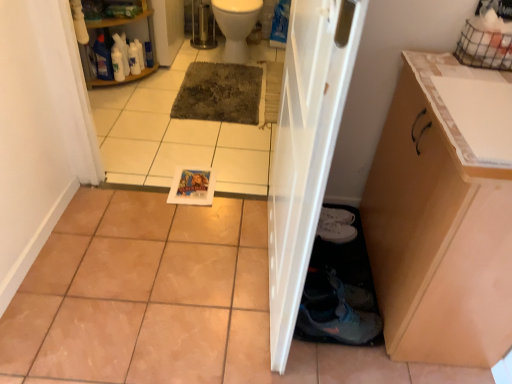
Locate an element on the screen. The image size is (512, 384). free space in front of white plastic shelf at upper left is located at coordinates (116, 104).